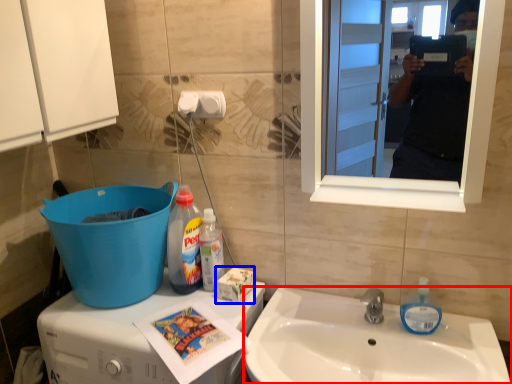
Question: Which point is further to the camera, sink (highlighted by a red box) or box (highlighted by a blue box)?

Choices:
 (A) sink
 (B) box

Answer: (B)